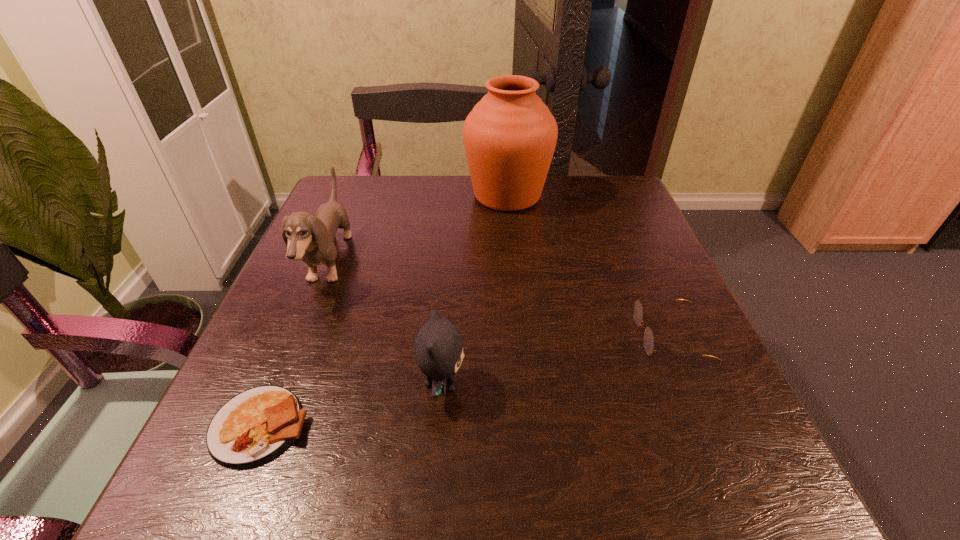
Where is `object that is at the far left corner`? The image size is (960, 540). object that is at the far left corner is located at coordinates (311, 238).

Find the location of `object at the near left corner`. object at the near left corner is located at coordinates click(x=256, y=425).

You are a GUI agent. You are given a task and a screenshot of the screen. Output one action in this format:
    pyautogui.click(x=<x>, y=<y>)
    Task: Click on the free space at the far edge
    
    Given the screenshot: What is the action you would take?
    pyautogui.click(x=417, y=189)

This screenshot has width=960, height=540. Identify the location of vacant area at the near edge of the desktop. (577, 482).

I want to click on vacant position at the right edge of the desktop, so click(636, 375).

Locate an element on the screen. Image resolution: width=960 pixels, height=540 pixels. vacant space at the far left corner of the desktop is located at coordinates (330, 193).

You are a GUI agent. You are given a task and a screenshot of the screen. Output one action in this format:
    pyautogui.click(x=<x>, y=<y>)
    Task: Click on the blank area at the far right corner
    Image resolution: width=960 pixels, height=540 pixels.
    Given the screenshot: What is the action you would take?
    pyautogui.click(x=576, y=174)

I want to click on vacant space at the near right corner, so click(x=723, y=466).

This screenshot has width=960, height=540. What are the coordinates of `vacant point located between the second shortest object and the farthest object` in the screenshot? It's located at (588, 266).

Find the location of `vacant space that is in between the fourth shortest object and the tallest object`. vacant space that is in between the fourth shortest object and the tallest object is located at coordinates (419, 229).